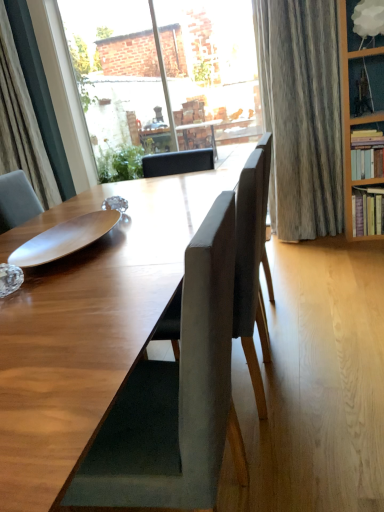
Find the location of a particular element. vacant space in front of suede-like gray chair at center, which ranks as the second chair in front-to-back order is located at coordinates (298, 457).